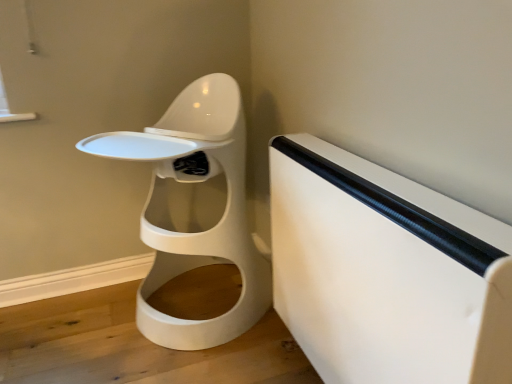
You are a GUI agent. You are given a task and a screenshot of the screen. Output one action in this format:
    pyautogui.click(x=<x>, y=<y>)
    Task: Click on the white matte toilet at center
    The height and width of the screenshot is (384, 512).
    Given the screenshot: What is the action you would take?
    pyautogui.click(x=195, y=232)

This screenshot has width=512, height=384. What do you see at coordinates (195, 232) in the screenshot?
I see `white matte toilet at center` at bounding box center [195, 232].

You are a GUI agent. You are given a task and a screenshot of the screen. Output one action in this format:
    pyautogui.click(x=<x>, y=<y>)
    Task: Click on the white matte changing table at right
    The height and width of the screenshot is (384, 512).
    Given the screenshot: What is the action you would take?
    pyautogui.click(x=385, y=272)

What is the approximate width of white matte changing table at right?

white matte changing table at right is 6.72 inches in width.

The image size is (512, 384). What do you see at coordinates (385, 272) in the screenshot?
I see `white matte changing table at right` at bounding box center [385, 272].

Find the location of a particular element. The image size is (512, 384). white matte toilet at center is located at coordinates (195, 232).

Is white matte toilet at center to the left or to the right of white matte changing table at right in the image?

Based on their positions, white matte toilet at center is located to the left of white matte changing table at right.

Is white matte toilet at center positioned behind white matte changing table at right?

Yes, the depth of white matte toilet at center is greater than that of white matte changing table at right.

Does point (245, 148) come behind point (396, 344)?

Yes, point (245, 148) is behind point (396, 344).

From the image's perspective, is white matte toilet at center located beneath white matte changing table at right?

No, from the image's perspective, white matte toilet at center is not beneath white matte changing table at right.

From a real-world perspective, is white matte toilet at center on top of white matte changing table at right?

Indeed, from a real-world perspective, white matte toilet at center stands above white matte changing table at right.

Looking at their sizes, would you say white matte toilet at center is wider or thinner than white matte changing table at right?

Clearly, white matte toilet at center has more width compared to white matte changing table at right.

Is white matte toilet at center taller than white matte changing table at right?

Yes, white matte toilet at center is taller than white matte changing table at right.

Which of these two, white matte toilet at center or white matte changing table at right, is smaller?

white matte changing table at right is smaller.

Is white matte toilet at center completely or partially outside of white matte changing table at right?

That's correct, white matte toilet at center is outside of white matte changing table at right.

Is white matte toilet at center with white matte changing table at right?

There is a gap between white matte toilet at center and white matte changing table at right.

Is white matte changing table at right at the back of white matte toilet at center?

white matte toilet at center is not turned away from white matte changing table at right.

What's the angular difference between white matte toilet at center and white matte changing table at right's facing directions?

The angular difference between white matte toilet at center and white matte changing table at right is 90.2 degrees.

How much distance is there between white matte toilet at center and white matte changing table at right?

white matte toilet at center and white matte changing table at right are 48.95 centimeters apart from each other.

Where is `toilet above the white matte changing table at right (from the image's perspective)`? The image size is (512, 384). toilet above the white matte changing table at right (from the image's perspective) is located at coordinates (195, 232).

Looking at this image, which object is positioned more to the right, white matte changing table at right or white matte toilet at center?

Positioned to the right is white matte changing table at right.

In the image, is white matte changing table at right positioned in front of or behind white matte toilet at center?

white matte changing table at right is in front of white matte toilet at center.

Based on the photo, which is less distant, (361, 182) or (161, 203)?

Point (361, 182)

From the image's perspective, which one is positioned higher, white matte changing table at right or white matte toilet at center?

white matte toilet at center appears higher in the image.

From a real-world perspective, is white matte changing table at right physically located above or below white matte toilet at center?

In terms of real-world spatial position, white matte changing table at right is below white matte toilet at center.

Consider the image. Can you confirm if white matte changing table at right is wider than white matte toilet at center?

Incorrect, the width of white matte changing table at right does not surpass that of white matte toilet at center.

In the scene shown: Who is taller, white matte changing table at right or white matte toilet at center?

With more height is white matte toilet at center.

Which of these two, white matte changing table at right or white matte toilet at center, is smaller?

white matte changing table at right is smaller.

Does white matte changing table at right contain white matte toilet at center?

No, white matte changing table at right does not contain white matte toilet at center.

Would you consider white matte changing table at right to be distant from white matte toilet at center?

white matte changing table at right is actually quite close to white matte toilet at center.

Is white matte changing table at right oriented away from white matte toilet at center?

white matte changing table at right is not turned away from white matte toilet at center.

How different are the orientations of white matte changing table at right and white matte toilet at center in degrees?

They differ by 90.2 degrees in their facing directions.

Find the location of a particular element. This screenshot has height=384, width=512. changing table that appears in front of the white matte toilet at center is located at coordinates (385, 272).

Find the location of a particular element. The width and height of the screenshot is (512, 384). changing table below the white matte toilet at center (from the image's perspective) is located at coordinates (385, 272).

Locate an element on the screen. The image size is (512, 384). changing table lying on the right of white matte toilet at center is located at coordinates (385, 272).